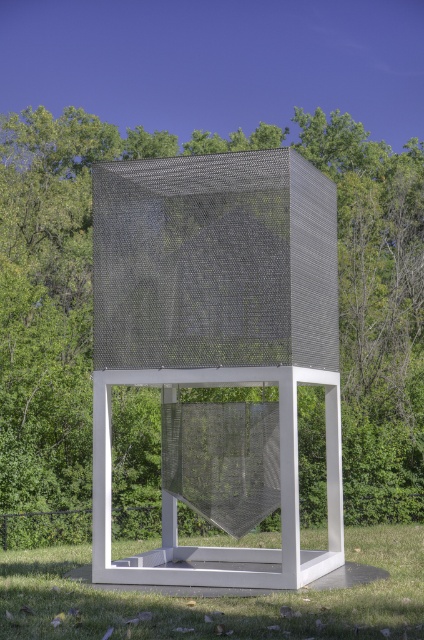
Question: Can you confirm if metal mesh cube at center is positioned to the left of green grass at lower center?

Choices:
 (A) yes
 (B) no

Answer: (B)

Question: Which object is farther from the camera taking this photo?

Choices:
 (A) metal mesh cube at center
 (B) green grass at lower center

Answer: (A)

Question: From the image, what is the correct spatial relationship of metal mesh cube at center in relation to green grass at lower center?

Choices:
 (A) right
 (B) left

Answer: (A)

Question: Is metal mesh cube at center wider than green grass at lower center?

Choices:
 (A) no
 (B) yes

Answer: (A)

Question: Which object is farther from the camera taking this photo?

Choices:
 (A) metal mesh cube at center
 (B) green grass at lower center

Answer: (A)